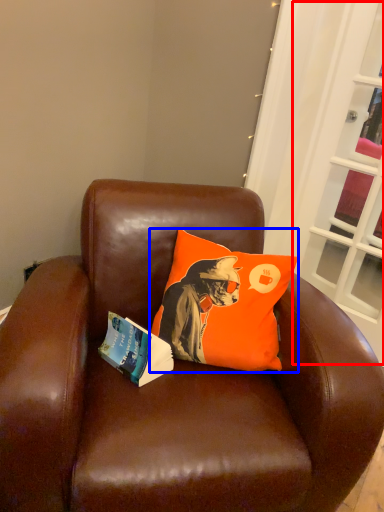
Question: Which point is further to the camera, screen door (highlighted by a red box) or pillow (highlighted by a blue box)?

Choices:
 (A) screen door
 (B) pillow

Answer: (A)